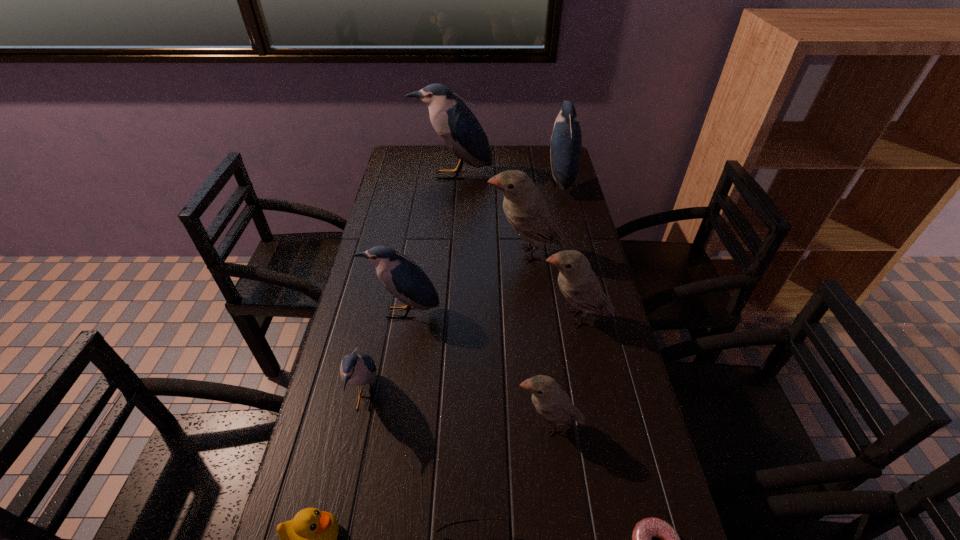
Point out which bird is positioned as the seventh nearest to the pink doughnut. Please provide its 2D coordinates. Your answer should be formatted as a tuple, i.e. [(x, y)], where the tuple contains the x and y coordinates of a point satisfying the conditions above.

[(457, 126)]

The height and width of the screenshot is (540, 960). I want to click on the third closest blue bird to the second nearest blue bird, so click(566, 140).

Locate which blue bird ranks in proximity to the rightmost blue bird. Please provide its 2D coordinates. Your answer should be formatted as a tuple, i.e. [(x, y)], where the tuple contains the x and y coordinates of a point satisfying the conditions above.

[(457, 126)]

The height and width of the screenshot is (540, 960). Identify the location of the closest white bird relative to the second nearest blue bird. (525, 210).

Identify which white bird is the second nearest to the nearest white bird. Please provide its 2D coordinates. Your answer should be formatted as a tuple, i.e. [(x, y)], where the tuple contains the x and y coordinates of a point satisfying the conditions above.

[(525, 210)]